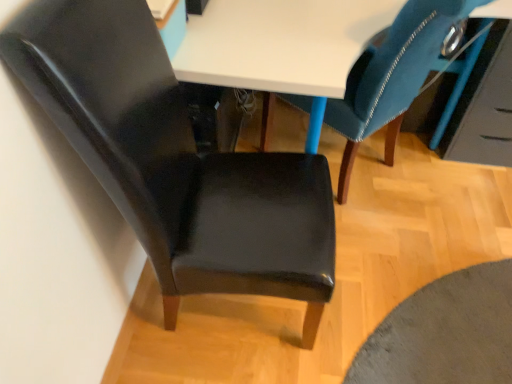
Question: From a real-world perspective, is velvet blue chair at upper right, which is counted as the second chair, starting from the left, physically located above or below glossy blue drawer at upper right?

Choices:
 (A) above
 (B) below

Answer: (A)

Question: From the image's perspective, relative to glossy blue drawer at upper right, is velvet blue chair at upper right, which is counted as the second chair, starting from the left, above or below?

Choices:
 (A) below
 (B) above

Answer: (A)

Question: Estimate the real-world distances between objects in this image. Which object is closer to the matte black chair at left, acting as the first chair starting from the left?

Choices:
 (A) glossy blue drawer at upper right
 (B) velvet blue chair at upper right, which is counted as the second chair, starting from the left

Answer: (B)

Question: Which object is positioned farthest from the matte black chair at left, marked as the 2th chair in a right-to-left arrangement?

Choices:
 (A) glossy blue drawer at upper right
 (B) velvet blue chair at upper right, the 1th chair when ordered from right to left

Answer: (A)